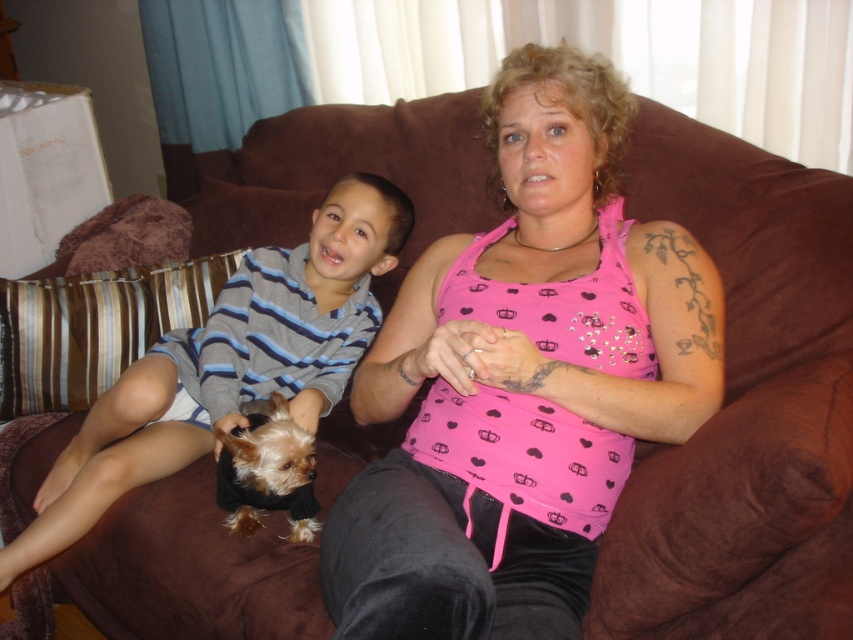
You are a photographer taking a picture of the striped knit sweater at left and the fuzzy black dog at center. Which object should you focus on first if you want to capture both in the frame without moving the camera?

The striped knit sweater at left is positioned on the left side of fuzzy black dog at center, so you should focus on the striped knit sweater at left first to ensure both are in the frame.

From the picture: You are designing a photo frame that needs to include both the striped knit sweater at left and the fuzzy black dog at center. To ensure the frame can accommodate both items without cropping, which object should determine the minimum required height of the frame?

The striped knit sweater at left has a greater height compared to the fuzzy black dog at center, so the frame should be at least as tall as the striped knit sweater at left to ensure both fit without cropping.

You are a fashion designer observing the image. You need to determine the spatial arrangement of the striped knit sweater at left and the black velvet pants at center. Which item is located more to the left?

The striped knit sweater at left is positioned on the left side of the black velvet pants at center, so the striped knit sweater at left is more to the left.